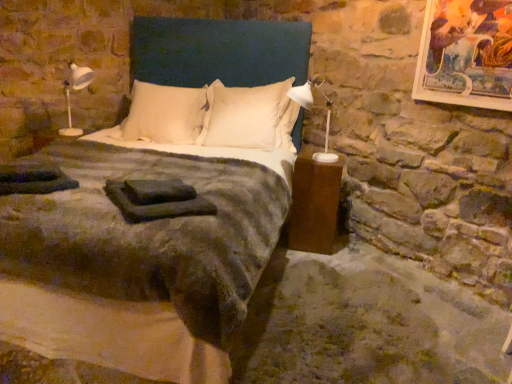
Question: Is the surface of brown matte nightstand at right in direct contact with white soft pillow at center, marked as the 1th pillow in a right-to-left arrangement?

Choices:
 (A) no
 (B) yes

Answer: (A)

Question: Considering the relative sizes of brown matte nightstand at right and white soft pillow at center, which is the 2th pillow in left-to-right order, in the image provided, is brown matte nightstand at right taller than white soft pillow at center, which is the 2th pillow in left-to-right order,?

Choices:
 (A) no
 (B) yes

Answer: (A)

Question: Can you confirm if brown matte nightstand at right is smaller than white soft pillow at center, which is the 2th pillow in left-to-right order?

Choices:
 (A) yes
 (B) no

Answer: (A)

Question: Is brown matte nightstand at right shorter than white soft pillow at center, marked as the 1th pillow in a right-to-left arrangement?

Choices:
 (A) yes
 (B) no

Answer: (A)

Question: Does brown matte nightstand at right have a lesser width compared to white soft pillow at center, which is the 2th pillow in left-to-right order?

Choices:
 (A) yes
 (B) no

Answer: (A)

Question: Is the depth of brown matte nightstand at right less than that of white soft pillow at center, marked as the 1th pillow in a right-to-left arrangement?

Choices:
 (A) no
 (B) yes

Answer: (B)

Question: From the image's perspective, does white soft pillow at center, marked as the 2th pillow in a right-to-left arrangement, appear lower than dark blue fabric headboard at center?

Choices:
 (A) yes
 (B) no

Answer: (B)

Question: Can you confirm if white soft pillow at center, marked as the 2th pillow in a right-to-left arrangement, is taller than dark blue fabric headboard at center?

Choices:
 (A) no
 (B) yes

Answer: (A)

Question: Is white soft pillow at center, the 1th pillow in the left-to-right sequence, positioned with its back to dark blue fabric headboard at center?

Choices:
 (A) yes
 (B) no

Answer: (B)

Question: Is white soft pillow at center, the 1th pillow in the left-to-right sequence, far from dark blue fabric headboard at center?

Choices:
 (A) no
 (B) yes

Answer: (A)

Question: Is white soft pillow at center, marked as the 2th pillow in a right-to-left arrangement, bigger than dark blue fabric headboard at center?

Choices:
 (A) no
 (B) yes

Answer: (A)

Question: From a real-world perspective, is white soft pillow at center, marked as the 2th pillow in a right-to-left arrangement, located beneath dark blue fabric headboard at center?

Choices:
 (A) no
 (B) yes

Answer: (B)

Question: Does white soft pillow at center, marked as the 2th pillow in a right-to-left arrangement, lie behind dark green fabric at center?

Choices:
 (A) yes
 (B) no

Answer: (A)